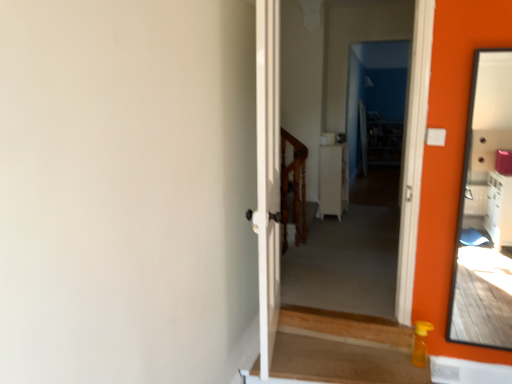
This screenshot has width=512, height=384. Describe the element at coordinates (333, 180) in the screenshot. I see `white glossy cabinet at center` at that location.

I want to click on white glossy cabinet at center, so click(x=333, y=180).

Measure the distance between wooden at center and camera.

wooden at center and camera are 3.78 meters apart.

Find the location of a particular element. The image size is (512, 384). white glossy cabinet at center is located at coordinates (333, 180).

Based on the photo, from a real-world perspective, which is physically below, wooden at center or white glossy cabinet at center?

wooden at center.

Is wooden at center located outside white glossy cabinet at center?

That's correct, wooden at center is outside of white glossy cabinet at center.

Is the depth of wooden at center greater than that of white glossy cabinet at center?

No, wooden at center is in front of white glossy cabinet at center.

Is white glossy cabinet at center facing away from matte orange mirror at right?

That's not correct — white glossy cabinet at center is not looking away from matte orange mirror at right.

Consider the image. Would you say white glossy cabinet at center is to the left or to the right of matte orange mirror at right in the picture?

In the image, white glossy cabinet at center appears on the left side of matte orange mirror at right.

Would you say white glossy cabinet at center is outside matte orange mirror at right?

That's correct, white glossy cabinet at center is outside of matte orange mirror at right.

From a real-world perspective, who is located higher, white glossy cabinet at center or wooden at center?

From a 3D spatial view, white glossy cabinet at center is above.

Is white glossy cabinet at center turned away from wooden at center?

No.

From the image's perspective, which one is positioned higher, white glossy cabinet at center or wooden at center?

white glossy cabinet at center.

Is white glossy cabinet at center wider than wooden at center?

Yes.

Is matte orange mirror at right facing towards wooden at center?

No, matte orange mirror at right is not oriented towards wooden at center.

Is matte orange mirror at right not within wooden at center?

matte orange mirror at right is positioned outside wooden at center.

Which object is wider, matte orange mirror at right or wooden at center?

With larger width is wooden at center.

Is matte orange mirror at right at the back of wooden at center?

No, wooden at center is not facing the opposite direction of matte orange mirror at right.

Would you say wooden at center is inside or outside matte orange mirror at right?

wooden at center is not enclosed by matte orange mirror at right.

Does wooden at center touch matte orange mirror at right?

wooden at center and matte orange mirror at right are clearly separated.

Is point (297, 245) behind point (457, 271)?

Yes, it is behind point (457, 271).

Is matte orange mirror at right positioned behind white glossy cabinet at center?

No, it is not.

Is matte orange mirror at right next to white glossy cabinet at center?

There is a gap between matte orange mirror at right and white glossy cabinet at center.

From the image's perspective, is matte orange mirror at right below white glossy cabinet at center?

Yes, from the image's perspective, matte orange mirror at right is beneath white glossy cabinet at center.

Can we say matte orange mirror at right lies outside white glossy cabinet at center?

Yes, matte orange mirror at right is outside of white glossy cabinet at center.

I want to click on table above the wooden at center (from a real-world perspective), so click(333, 180).

Locate an element on the screen. Image resolution: width=512 pixels, height=384 pixels. mirror that is below the white glossy cabinet at center (from the image's perspective) is located at coordinates (485, 211).

Estimate the real-world distances between objects in this image. Which object is closer to white glossy cabinet at center, wooden at center or matte orange mirror at right?

Among the two, wooden at center is located nearer to white glossy cabinet at center.

Considering their positions, is white glossy cabinet at center positioned further to wooden at center than matte orange mirror at right?

matte orange mirror at right lies further to wooden at center than the other object.

Based on their spatial positions, is matte orange mirror at right or wooden at center further from white glossy cabinet at center?

Among the two, matte orange mirror at right is located further to white glossy cabinet at center.

Which object lies further to the anchor point wooden at center, matte orange mirror at right or white glossy cabinet at center?

The object further to wooden at center is matte orange mirror at right.

When comparing their distances from matte orange mirror at right, does wooden at center or white glossy cabinet at center seem closer?

white glossy cabinet at center.

From the image, which object appears to be farther from matte orange mirror at right, white glossy cabinet at center or wooden at center?

wooden at center is positioned further to the anchor matte orange mirror at right.

You are a GUI agent. You are given a task and a screenshot of the screen. Output one action in this format:
    pyautogui.click(x=<x>, y=<y>)
    Task: Click on the balustrade positioned between matte orange mirror at right and white glossy cabinet at center from near to far
    
    Given the screenshot: What is the action you would take?
    pyautogui.click(x=293, y=189)